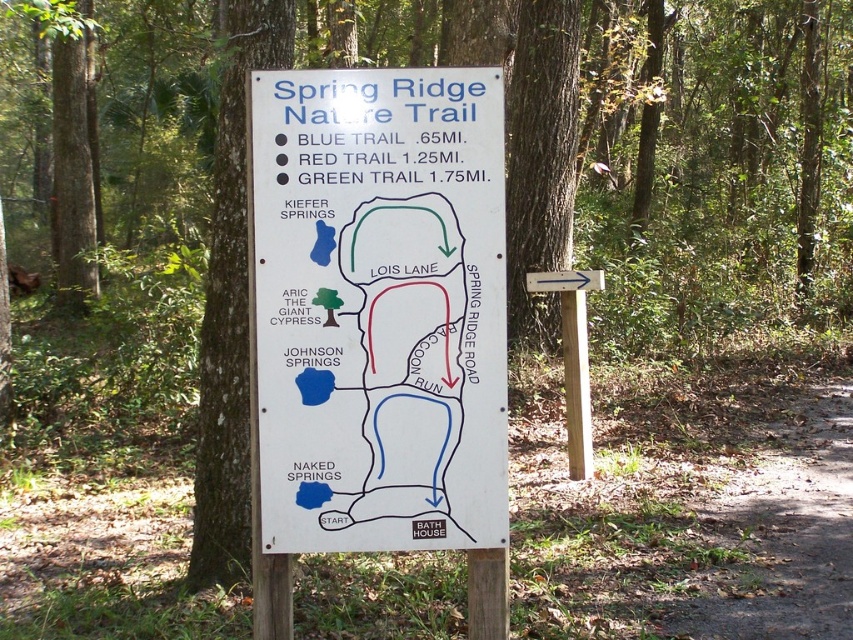
You are a hiker standing in front of the white paper sign at center and the brown rough bark tree at left. Which object is positioned to the left of the other?

The brown rough bark tree at left is to the left of the white paper sign at center.

You are standing at the point marked on the map at coordinates point (850, 381). You want to walk to the Kiefer Springs, which is 28.99 feet away from your current position. Can you reach Kiefer Springs within 30 feet of walking?

Yes, since the distance between point (850, 381) and Kiefer Springs is 28.99 feet, which is within the 30 feet limit.

You are a hiker who wants to take the shortest trail starting from the dirt path at lower right. According to the white paper sign at center, which trail should you choose?

The Blue Trail is the shortest at 0.65 miles. The white paper sign at center indicates the trails, so you should choose the Blue Trail.